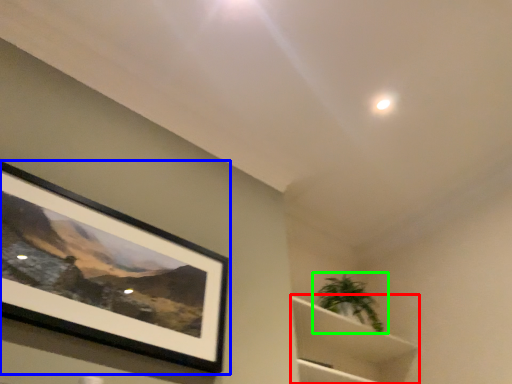
Question: Estimate the real-world distances between objects in this image. Which object is farther from cabinet (highlighted by a red box), picture frame (highlighted by a blue box) or houseplant (highlighted by a green box)?

Choices:
 (A) picture frame
 (B) houseplant

Answer: (A)